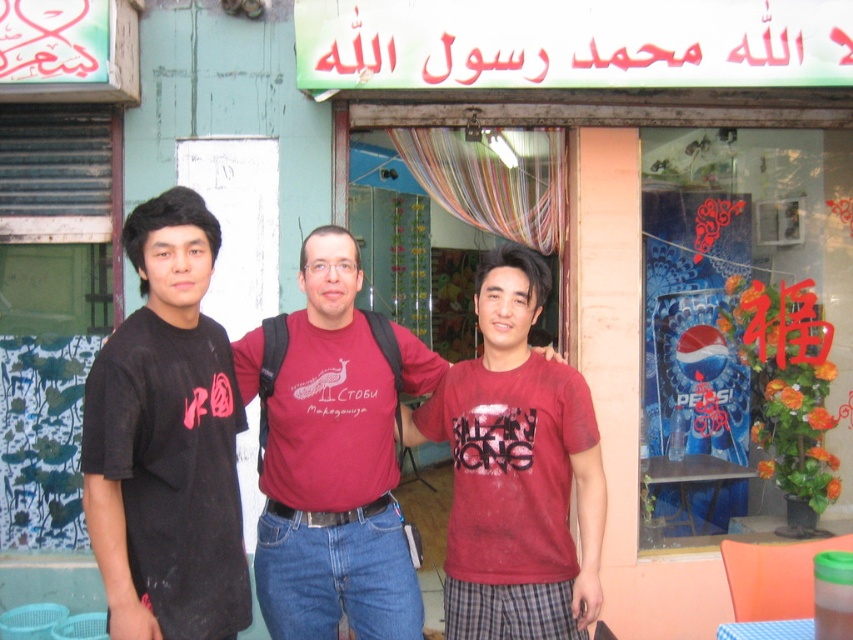
Question: Is black matte t-shirt at left below maroon cotton t-shirt at center?

Choices:
 (A) no
 (B) yes

Answer: (A)

Question: Which of the following is the closest to the observer?

Choices:
 (A) black matte t-shirt at center
 (B) black matte t-shirt at left
 (C) maroon cotton t-shirt at center

Answer: (B)

Question: Considering the relative positions of maroon cotton t-shirt at center and black matte t-shirt at center in the image provided, where is maroon cotton t-shirt at center located with respect to black matte t-shirt at center?

Choices:
 (A) left
 (B) right

Answer: (B)

Question: Estimate the real-world distances between objects in this image. Which object is farther from the maroon cotton t-shirt at center?

Choices:
 (A) black matte t-shirt at center
 (B) black matte t-shirt at left

Answer: (B)

Question: Which object is the farthest from the maroon cotton t-shirt at center?

Choices:
 (A) black matte t-shirt at left
 (B) black matte t-shirt at center

Answer: (A)

Question: Is black matte t-shirt at left smaller than maroon cotton t-shirt at center?

Choices:
 (A) no
 (B) yes

Answer: (B)